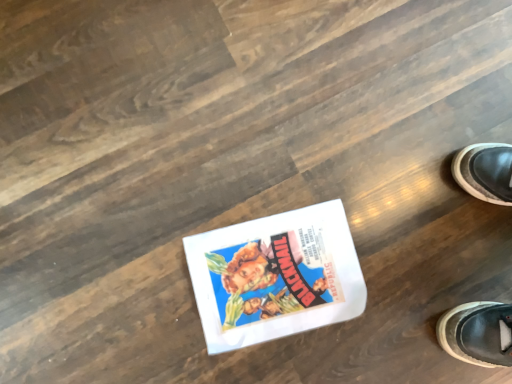
Locate an element on the screen. The width and height of the screenshot is (512, 384). vacant region below matte paper book at center (from a real-world perspective) is located at coordinates (280, 281).